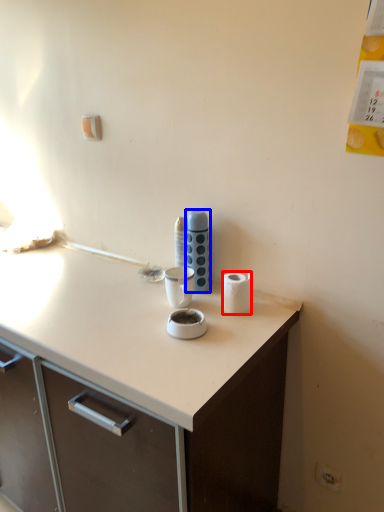
Question: Which object appears closest to the camera in this image, paper towel (highlighted by a red box) or appliance (highlighted by a blue box)?

Choices:
 (A) paper towel
 (B) appliance

Answer: (A)